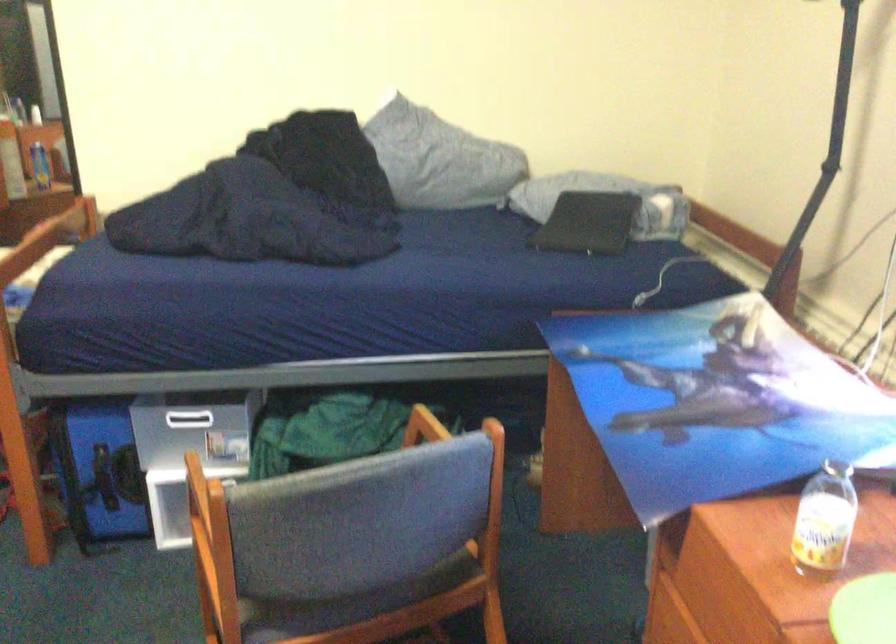
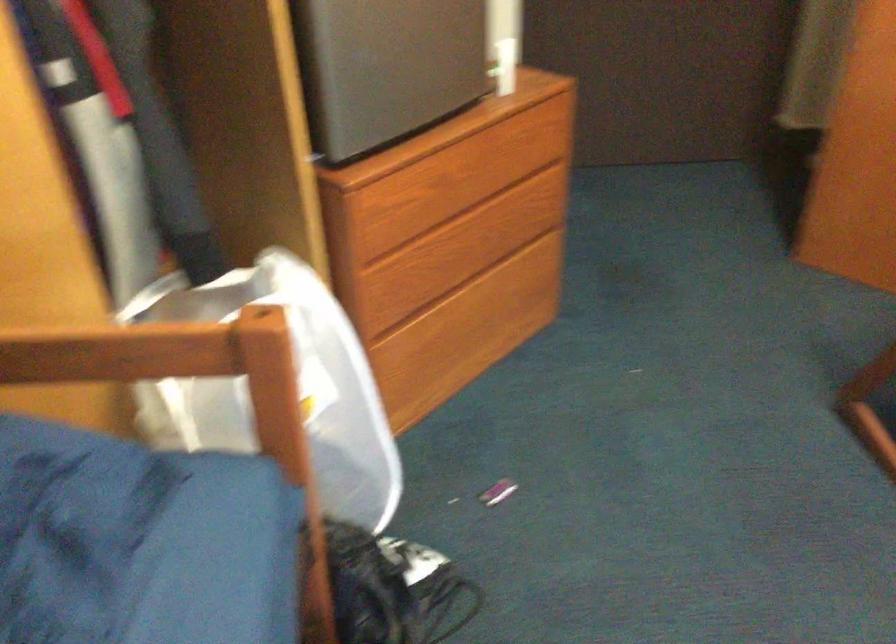
The images are taken continuously from a first-person perspective. In which direction is your viewpoint rotating?

The rotation direction of the camera is left-down.